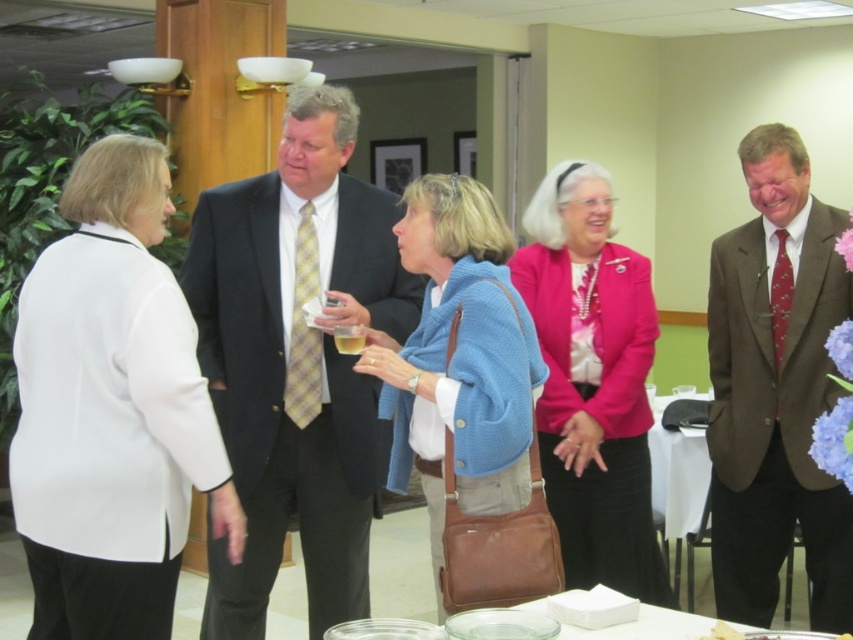
Question: In this image, where is matte black suit at center located relative to blue knitted sweater at center?

Choices:
 (A) above
 (B) below

Answer: (A)

Question: Which of the following is the closest to the observer?

Choices:
 (A) (213, 317)
 (B) (824, 483)

Answer: (B)

Question: Which of these objects is positioned farthest from the pink satin jacket at center?

Choices:
 (A) white fabric jacket at left
 (B) blue knitted sweater at center
 (C) brown textured suit at center
 (D) matte black suit at center

Answer: (A)

Question: Is matte black suit at center thinner than clear glass plates at center?

Choices:
 (A) no
 (B) yes

Answer: (B)

Question: Where is pink satin jacket at center located in relation to blue knitted sweater at center in the image?

Choices:
 (A) right
 (B) left

Answer: (A)

Question: Which object is the farthest from the blue knitted sweater at center?

Choices:
 (A) white fabric jacket at left
 (B) pink satin jacket at center

Answer: (B)